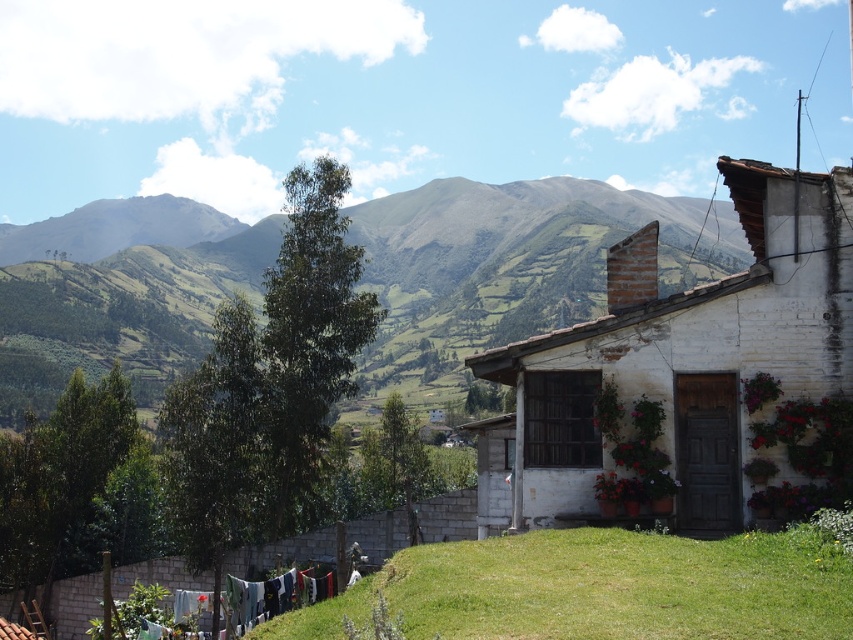
Question: Which of the following is the farthest from the observer?

Choices:
 (A) (231, 604)
 (B) (737, 429)

Answer: (A)

Question: Is the position of white brick house at right less distant than that of multicolored fabric at lower left?

Choices:
 (A) yes
 (B) no

Answer: (A)

Question: Is white brick house at right closer to camera compared to multicolored fabric at lower left?

Choices:
 (A) yes
 (B) no

Answer: (A)

Question: Which of the following is the closest to the observer?

Choices:
 (A) (572, 461)
 (B) (189, 614)

Answer: (A)

Question: Is white brick house at right below multicolored fabric at lower left?

Choices:
 (A) no
 (B) yes

Answer: (A)